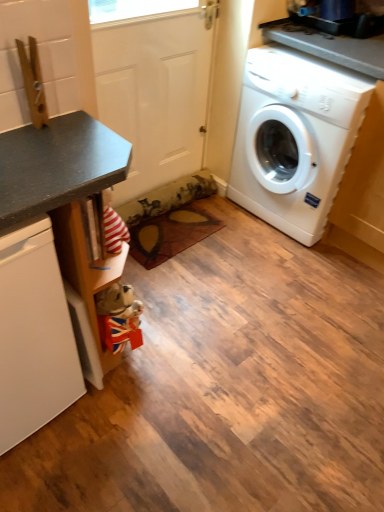
Locate an element on the screen. white plastic washing machine at right is located at coordinates (295, 138).

This screenshot has width=384, height=512. Describe the element at coordinates (154, 93) in the screenshot. I see `white matte door at center` at that location.

Where is `white plastic washing machine at right`? Image resolution: width=384 pixels, height=512 pixels. white plastic washing machine at right is located at coordinates (295, 138).

In the scene shown: Is white matte door at center smaller than white plastic washing machine at right?

Yes.

From a real-world perspective, is white matte door at center on white plastic washing machine at right?

Yes, from a real-world perspective, white matte door at center is over white plastic washing machine at right

Between white matte door at center and white plastic washing machine at right, which one has smaller width?

With smaller width is white matte door at center.

Does matte black counter at left appear on the left side of white matte dishwasher at left?

Incorrect, matte black counter at left is not on the left side of white matte dishwasher at left.

Considering the points (57, 201) and (10, 406), which point is behind, point (57, 201) or point (10, 406)?

The point (10, 406) is behind.

Is matte black counter at left not within white matte dishwasher at left?

That's incorrect, matte black counter at left is not completely outside white matte dishwasher at left.

Considering the sizes of objects matte black counter at left and white matte dishwasher at left in the image provided, who is thinner, matte black counter at left or white matte dishwasher at left?

white matte dishwasher at left is thinner.

From the image's perspective, which one is positioned higher, white matte dishwasher at left or white plastic washing machine at right?

white plastic washing machine at right.

Could you tell me if white matte dishwasher at left is turned towards white plastic washing machine at right?

No, white matte dishwasher at left is not facing towards white plastic washing machine at right.

Looking at this image, how many degrees apart are the facing directions of white matte dishwasher at left and white plastic washing machine at right?

They differ by 87.9 degrees in their facing directions.

Is white matte dishwasher at left far from white plastic washing machine at right?

Yes, white matte dishwasher at left and white plastic washing machine at right are located far from each other.

From the image's perspective, which object appears higher, matte black counter at left or white matte door at center?

white matte door at center is shown above in the image.

Is matte black counter at left next to white matte door at center?

No, matte black counter at left is not in contact with white matte door at center.

Is white matte door at center surrounded by matte black counter at left?

No, white matte door at center is not a part of matte black counter at left.

Looking at this image, can you confirm if matte black counter at left is positioned to the right of white matte door at center?

No, matte black counter at left is not to the right of white matte door at center.

Considering the relative sizes of white matte dishwasher at left and matte black counter at left in the image provided, is white matte dishwasher at left wider than matte black counter at left?

Incorrect, the width of white matte dishwasher at left does not surpass that of matte black counter at left.

From a real-world perspective, is white matte dishwasher at left physically below matte black counter at left?

Yes, from a real-world perspective, white matte dishwasher at left is beneath matte black counter at left.

In the scene shown: Which point is more forward, (49, 397) or (26, 242)?

The point (26, 242) is closer.

Considering the relative sizes of white matte door at center and white matte dishwasher at left in the image provided, is white matte door at center smaller than white matte dishwasher at left?

Correct, white matte door at center occupies less space than white matte dishwasher at left.

From the image's perspective, which object appears higher, white matte door at center or white matte dishwasher at left?

white matte door at center appears higher in the image.

Between white matte door at center and white matte dishwasher at left, which one is positioned behind?

white matte door at center is further from the camera.

Is white matte door at center not close to matte black counter at left?

No, there isn't a large distance between white matte door at center and matte black counter at left.

Between point (194, 55) and point (0, 399), which one is positioned in front?

Positioned in front is point (0, 399).

From the image's perspective, is white matte door at center under matte black counter at left?

Actually, white matte door at center appears above matte black counter at left in the image.

Find the location of a particular element. This screenshot has width=384, height=512. screen door above the white plastic washing machine at right (from a real-world perspective) is located at coordinates (154, 93).

In order to click on counter in front of the white matte dishwasher at left in this screenshot , I will do `click(60, 182)`.

Consider the image. Which object lies further to the anchor point matte black counter at left, white matte dishwasher at left or white plastic washing machine at right?

The object further to matte black counter at left is white plastic washing machine at right.

From the image, which object appears to be farther from white plastic washing machine at right, white matte door at center or white matte dishwasher at left?

white matte dishwasher at left is positioned further to the anchor white plastic washing machine at right.

Estimate the real-world distances between objects in this image. Which object is closer to matte black counter at left, white matte door at center or white plastic washing machine at right?

white matte door at center.

Looking at the image, which one is located closer to matte black counter at left, white plastic washing machine at right or white matte dishwasher at left?

white matte dishwasher at left lies closer to matte black counter at left than the other object.

Looking at the image, which one is located further to matte black counter at left, white plastic washing machine at right or white matte door at center?

white plastic washing machine at right lies further to matte black counter at left than the other object.

Estimate the real-world distances between objects in this image. Which object is further from white matte dishwasher at left, white plastic washing machine at right or matte black counter at left?

white plastic washing machine at right is positioned further to the anchor white matte dishwasher at left.

Based on their spatial positions, is white plastic washing machine at right or matte black counter at left further from white matte door at center?

matte black counter at left is positioned further to the anchor white matte door at center.

Based on their spatial positions, is matte black counter at left or white matte door at center further from white matte dishwasher at left?

Among the two, white matte door at center is located further to white matte dishwasher at left.

Find the location of `screen door between white matte dishwasher at left and white plastic washing machine at right`. screen door between white matte dishwasher at left and white plastic washing machine at right is located at coordinates tap(154, 93).

You are a GUI agent. You are given a task and a screenshot of the screen. Output one action in this format:
    pyautogui.click(x=<x>, y=<y>)
    Task: Click on the screen door located between matte black counter at left and white plastic washing machine at right in the left-right direction
    The width and height of the screenshot is (384, 512).
    Given the screenshot: What is the action you would take?
    pyautogui.click(x=154, y=93)

Identify the location of counter between white matte door at center and white matte dishwasher at left from top to bottom. (60, 182).

Where is `counter located between white matte dishwasher at left and white plastic washing machine at right in the left-right direction`? counter located between white matte dishwasher at left and white plastic washing machine at right in the left-right direction is located at coordinates coord(60,182).